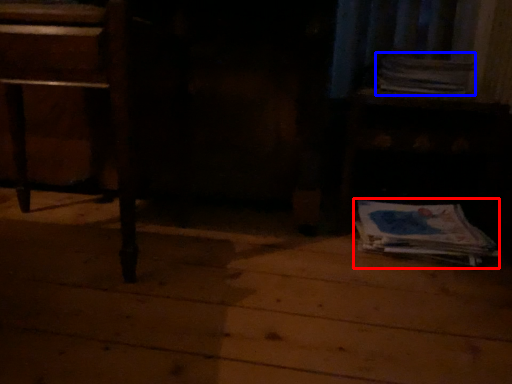
Question: Which point is closer to the camera, paperback book (highlighted by a red box) or paperback book (highlighted by a blue box)?

Choices:
 (A) paperback book
 (B) paperback book

Answer: (A)